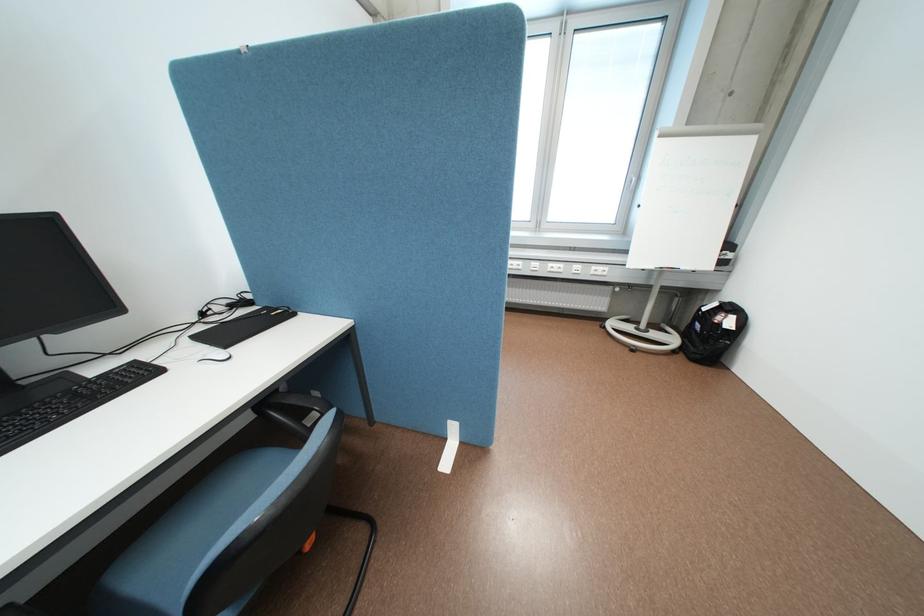
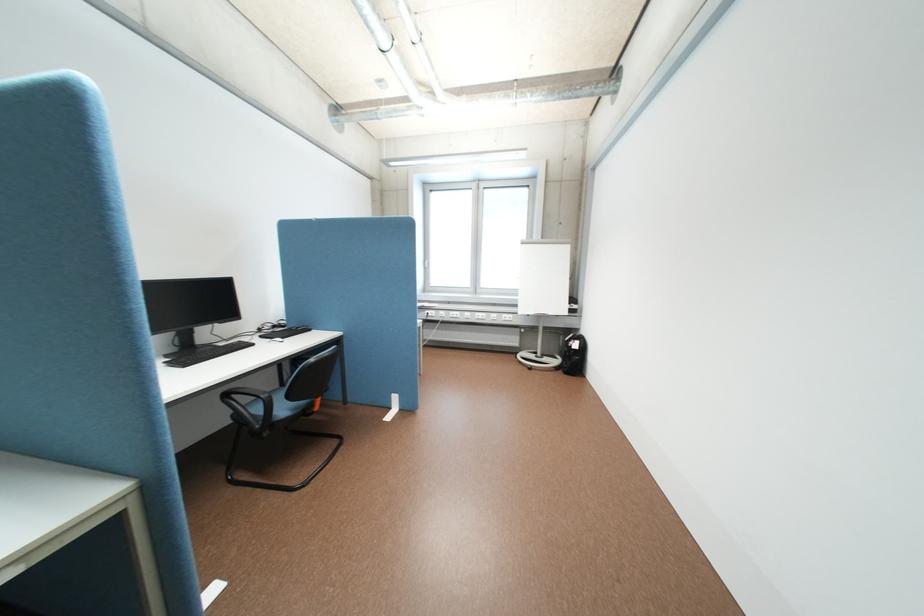
In a continuous first-person perspective shot, in which direction is the camera moving?

The movement direction of the cameraman is right, backward.